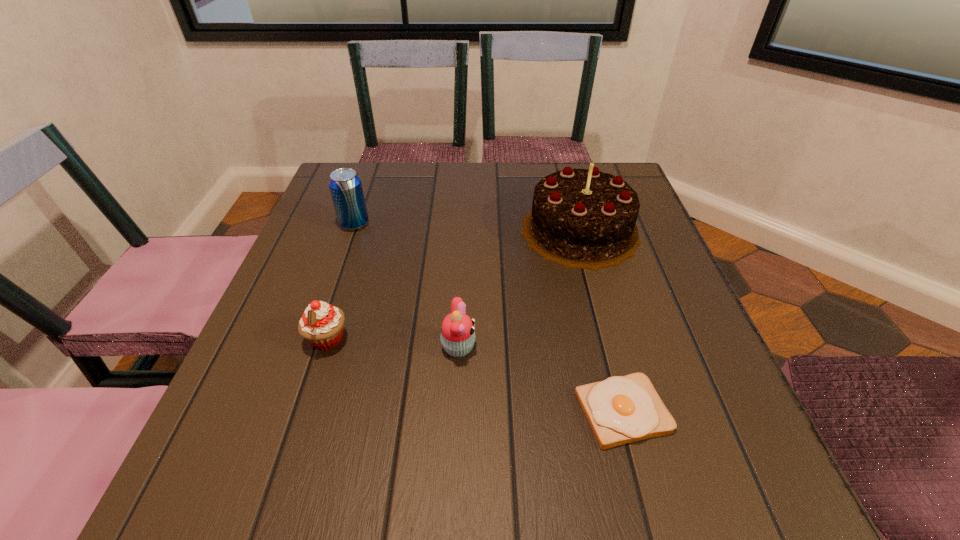
At what (x,y) coordinates should I click in order to perform the action: click on free point between the second tallest object and the right cupcake. Please return your answer as a coordinate pair (x, y). Looking at the image, I should click on (406, 286).

At what (x,y) coordinates should I click in order to perform the action: click on free spot between the left cupcake and the beer can. Please return your answer as a coordinate pair (x, y). This screenshot has width=960, height=540. Looking at the image, I should click on (341, 282).

This screenshot has height=540, width=960. In order to click on object that can be found as the fourth closest to the beer can in this screenshot , I will do `click(621, 409)`.

Select which object appears as the second closest to the birthday cake. Please provide its 2D coordinates. Your answer should be formatted as a tuple, i.e. [(x, y)], where the tuple contains the x and y coordinates of a point satisfying the conditions above.

[(621, 409)]

I want to click on free space that satisfies the following two spatial constraints: 1. on the back side of the shortest object; 2. on the face of the right cupcake, so click(x=606, y=348).

Where is `vacant area that satisfies the following two spatial constraints: 1. on the face of the third object from right to left; 2. on the back side of the toast`? This screenshot has height=540, width=960. vacant area that satisfies the following two spatial constraints: 1. on the face of the third object from right to left; 2. on the back side of the toast is located at coordinates (455, 411).

You are a GUI agent. You are given a task and a screenshot of the screen. Output one action in this format:
    pyautogui.click(x=<x>, y=<y>)
    Task: Click on the free location that satisfies the following two spatial constraints: 1. on the face of the third object from right to left; 2. on the back side of the nearest object
    
    Given the screenshot: What is the action you would take?
    click(x=455, y=411)

This screenshot has width=960, height=540. In order to click on vacant point that satisfies the following two spatial constraints: 1. on the face of the right cupcake; 2. on the left side of the shortest object in this screenshot , I will do `click(455, 411)`.

Identify the location of vacant region that satisfies the following two spatial constraints: 1. on the back side of the tallest object; 2. on the right side of the left cupcake. (362, 231).

The image size is (960, 540). In order to click on free space that satisfies the following two spatial constraints: 1. on the face of the third object from right to left; 2. on the right side of the shortest object in this screenshot , I will do `click(455, 411)`.